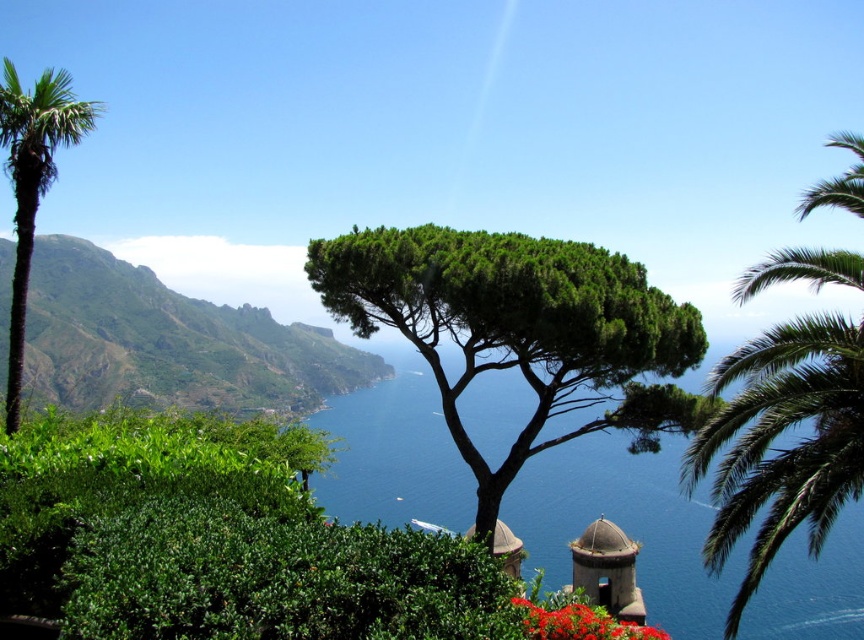
You are a hiker standing at the base of the green leafy hillside at upper left. You want to reach the blue water at center. Which direction should you move relative to the hillside?

The blue water at center is located below the green leafy hillside at upper left, so you should move downward from the green leafy hillside at upper left to reach the blue water at center.

You are a drone operator trying to capture a photo of the green leafy tree at center. The drone is currently at point A which is at coordinates 0.3,0.4. To reach the tree, the drone needs to move in a straight line. In which direction should the drone move? North, South, East, or West?

The green leafy tree at center is located at point (519, 330). Since the drone is at (345, 192), it should move northeast to reach the tree.

You are a photographer planning to capture the green leafy palm tree at left and the bright red petals at center in a single frame. Which object should you focus on first if you want to ensure both fit in the frame without moving the camera?

You should focus on the green leafy palm tree at left first because it is wider than the bright red petals at center, so ensuring it fits properly will help accommodate the smaller petals within the frame.